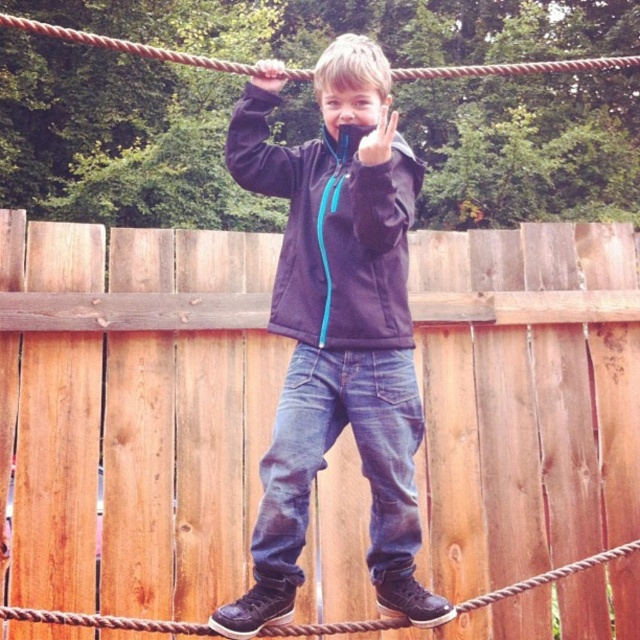
You are a park visitor standing at the starting point of the rope bridge. You notice two points marked on the bridge. The first point is at coordinates point (461, 579) and the second point is at point (621, 60). Which point is closer to you as you begin your walk?

Point (461, 579) is closer to you because it is further to the viewer than point (621, 60).

You are designing a safety inspection system for the rope bridge. The system needs to ensure that the distance between the matte blue jacket at center and the nearest wooden plank is at least 10 cm for safety. Can you confirm if this requirement is met based on the coordinates provided?

The matte blue jacket at center is located at point (332,230). However, without knowing the coordinates of the wooden planks or the scale of the coordinate system, it is impossible to determine the distance between the jacket and the nearest wooden plank. Additional information is required to confirm compliance with the safety requirement.

You are standing at the point marked as point (385, 307) on the rope bridge in the image. You want to throw a ball to a friend who is standing 2.48 meters away from you. If your friend is directly in front of you, will the ball land in front of or behind them?

The point marked as point (385, 307) and the viewer are 2.48 meters apart. If your friend is standing 2.48 meters away from you at that point, the ball will land exactly where your friend is standing, so it will land directly in front of them.